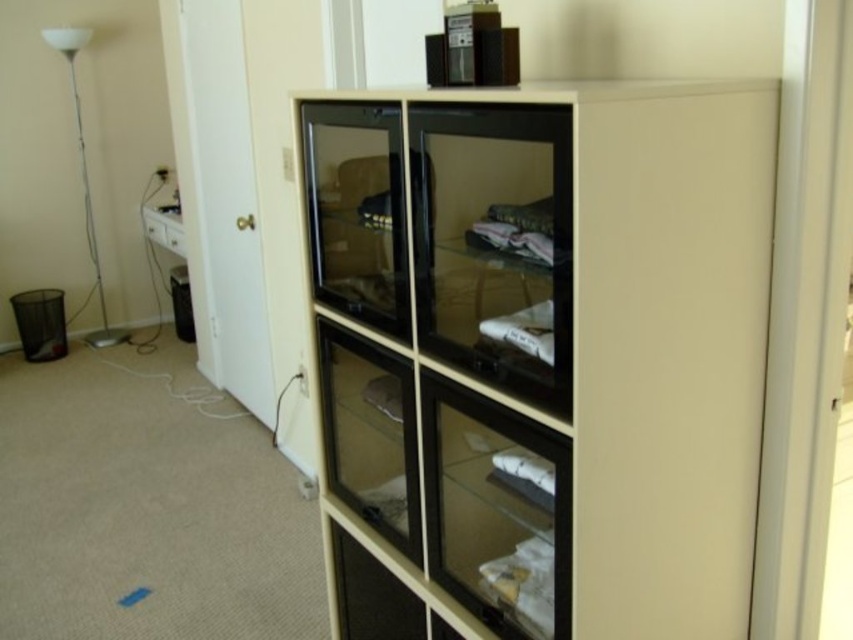
Question: Which object appears closest to the camera in this image?

Choices:
 (A) transparent glass door at center
 (B) white glossy floor lamp at left
 (C) white glossy drawer at left
 (D) white fabric at center

Answer: (A)

Question: Is beige matte cabinet at center positioned in front of white fabric at center?

Choices:
 (A) yes
 (B) no

Answer: (A)

Question: Based on their relative distances, which object is farther from the white fabric at center?

Choices:
 (A) beige matte cabinet at center
 (B) white glossy floor lamp at left
 (C) transparent glass door at center
 (D) white glossy drawer at left

Answer: (B)

Question: Can you confirm if transparent glass door at center is thinner than white fabric at center?

Choices:
 (A) yes
 (B) no

Answer: (B)

Question: Can you confirm if beige matte cabinet at center is positioned above white glossy floor lamp at left?

Choices:
 (A) no
 (B) yes

Answer: (A)

Question: Which point appears farthest from the camera in this image?

Choices:
 (A) (544, 252)
 (B) (88, 38)
 (C) (177, 244)
 (D) (491, 330)

Answer: (C)